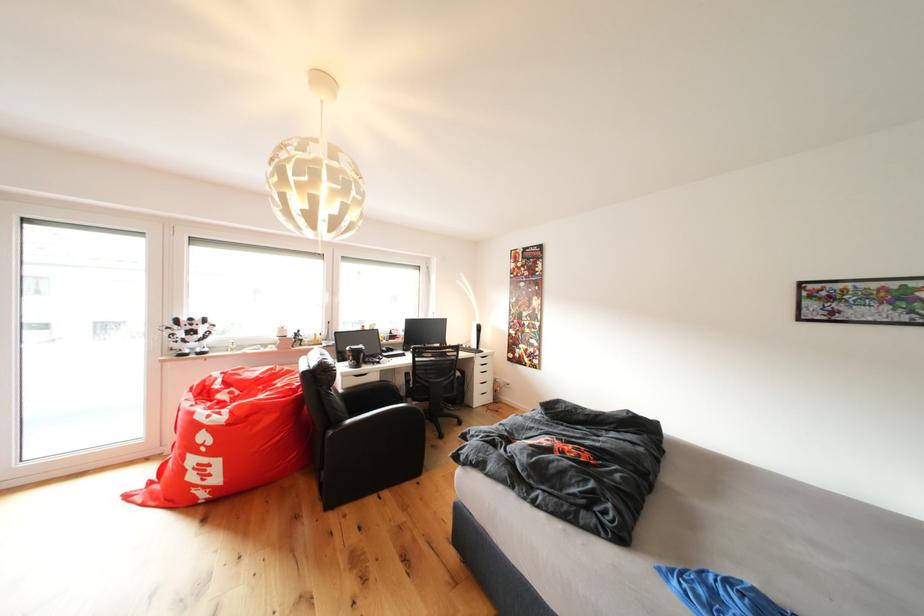
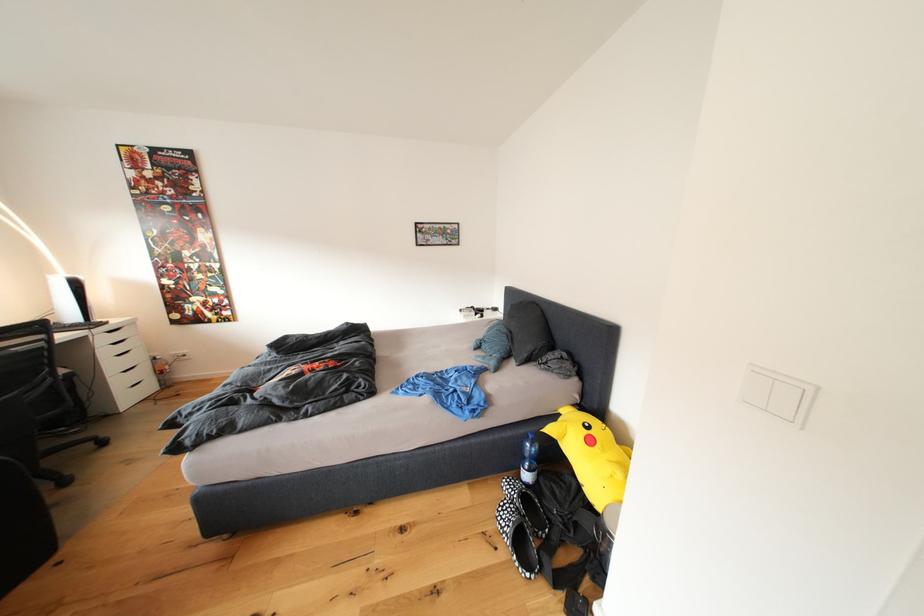
Locate, in the second image, the point that corresponds to pixel 487 366 in the first image.

(111, 344)